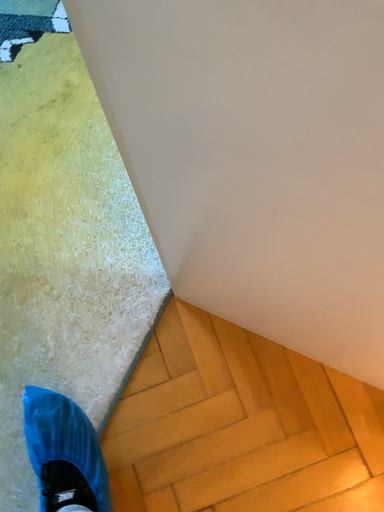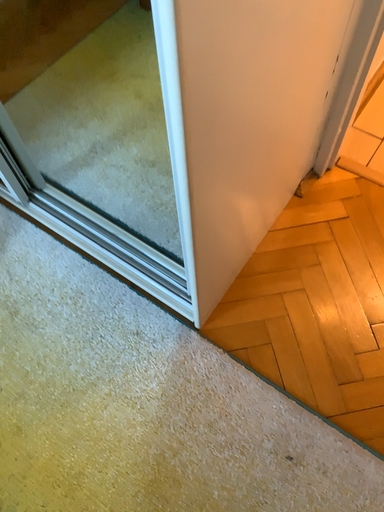
Question: Which way did the camera rotate in the video?

Choices:
 (A) rotated left
 (B) rotated right

Answer: (B)